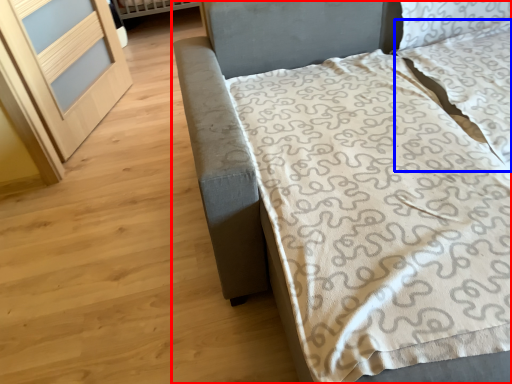
Question: Which object appears closest to the camera in this image, bed (highlighted by a red box) or pillow (highlighted by a blue box)?

Choices:
 (A) bed
 (B) pillow

Answer: (A)